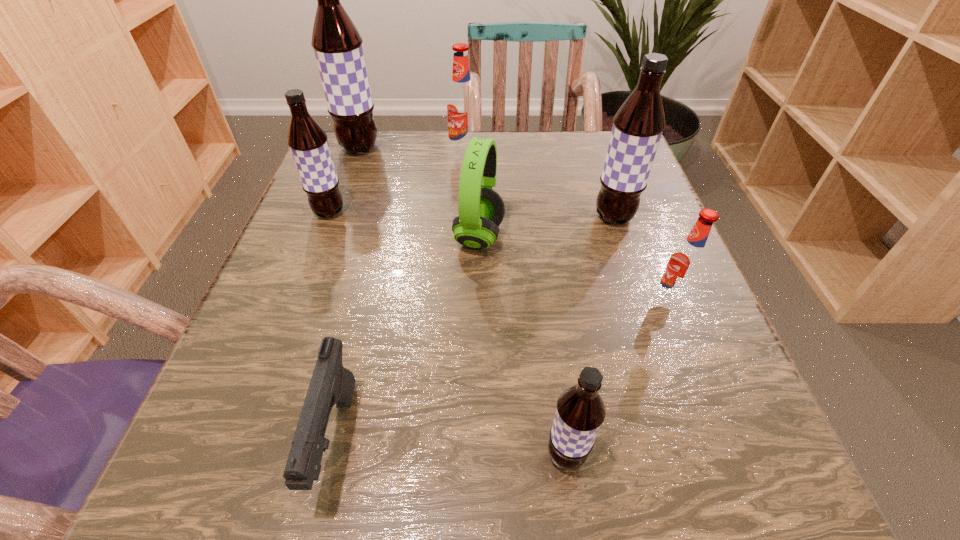
The width and height of the screenshot is (960, 540). What are the coordinates of `the sixth object from left to right` in the screenshot? It's located at (580, 411).

This screenshot has width=960, height=540. In order to click on the second brown root beer from right to left in this screenshot , I will do `click(580, 411)`.

The height and width of the screenshot is (540, 960). Identify the location of the shortest object. tap(331, 383).

In order to click on pistol in this screenshot , I will do `click(331, 383)`.

Where is `vacant space located on the front of the farthest brown root beer`? This screenshot has height=540, width=960. vacant space located on the front of the farthest brown root beer is located at coordinates (348, 179).

Find the location of `vacant region located on the left of the second biggest brown root beer`. vacant region located on the left of the second biggest brown root beer is located at coordinates (541, 217).

Where is `vacant area situated 0.230m on the right of the bigger red root beer`? This screenshot has width=960, height=540. vacant area situated 0.230m on the right of the bigger red root beer is located at coordinates (577, 154).

Identify the location of free region located on the back of the third biggest brown root beer. (351, 155).

Find the location of `vacant region located 0.310m on the back of the headset`. vacant region located 0.310m on the back of the headset is located at coordinates (479, 134).

Where is `vacant area situated on the front of the nearer red root beer`? vacant area situated on the front of the nearer red root beer is located at coordinates (743, 488).